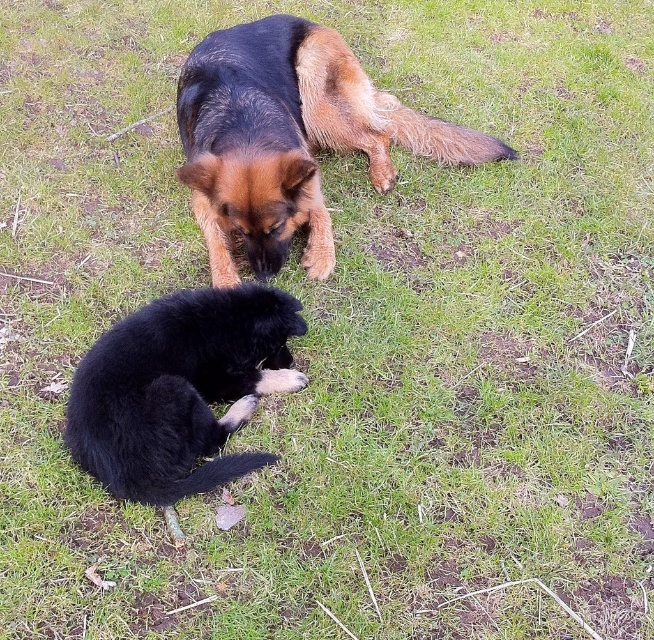
Identify the location of brown-furred dog at upper center. (288, 138).

Identify the location of brown-furred dog at upper center. (288, 138).